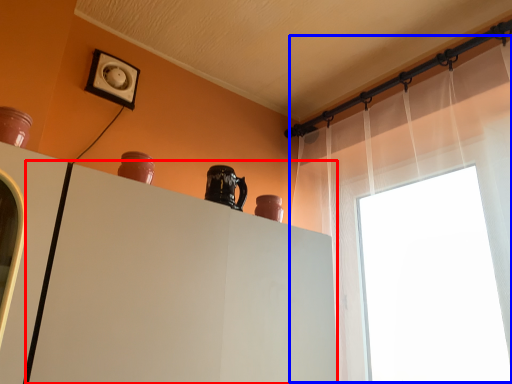
Question: Among these objects, which one is nearest to the camera, cabinetry (highlighted by a red box) or shower curtain (highlighted by a blue box)?

Choices:
 (A) cabinetry
 (B) shower curtain

Answer: (A)